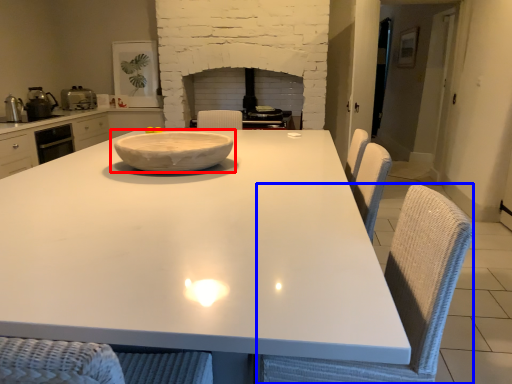
Question: Which object appears closest to the camera in this image, bowl (highlighted by a red box) or swivel chair (highlighted by a blue box)?

Choices:
 (A) bowl
 (B) swivel chair

Answer: (B)